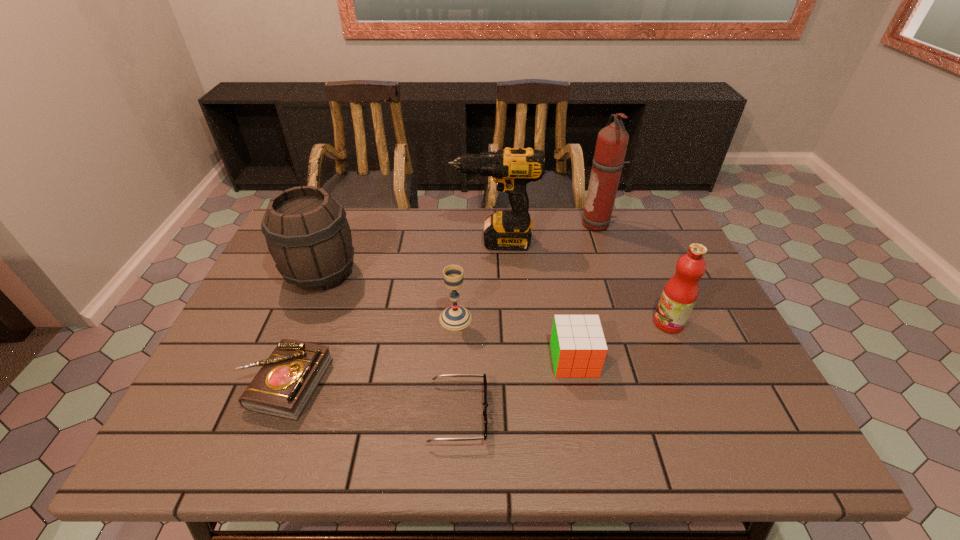
Locate an element on the screen. Image resolution: width=960 pixels, height=540 pixels. free point between the diary and the fourth shortest object is located at coordinates pyautogui.click(x=370, y=350).

Find the location of `vacant area that lies between the wine bucket and the seventh tallest object`. vacant area that lies between the wine bucket and the seventh tallest object is located at coordinates (302, 328).

At what (x,y) coordinates should I click in order to perform the action: click on vacant space that's between the tallest object and the drill. Please return your answer as a coordinate pair (x, y). The image size is (960, 540). Looking at the image, I should click on (546, 233).

Identify the location of vacant area that lies between the third shortest object and the rightmost object. The height and width of the screenshot is (540, 960). (621, 341).

The height and width of the screenshot is (540, 960). I want to click on unoccupied area between the fifth tallest object and the shortest object, so click(457, 366).

The height and width of the screenshot is (540, 960). In order to click on vacant region between the wine bucket and the fruit juice in this screenshot , I will do `click(494, 298)`.

Where is `free space between the tallest object and the diary`? The width and height of the screenshot is (960, 540). free space between the tallest object and the diary is located at coordinates [441, 304].

Where is `object identified as the fourth closest to the shortest object`? The width and height of the screenshot is (960, 540). object identified as the fourth closest to the shortest object is located at coordinates (307, 233).

Where is `object identified as the sixth closest to the wine bucket`? The image size is (960, 540). object identified as the sixth closest to the wine bucket is located at coordinates (612, 141).

Identify the location of vacant space that satisfies the following two spatial constraints: 1. on the front side of the cube; 2. on the right side of the fourth shortest object. The width and height of the screenshot is (960, 540). (453, 360).